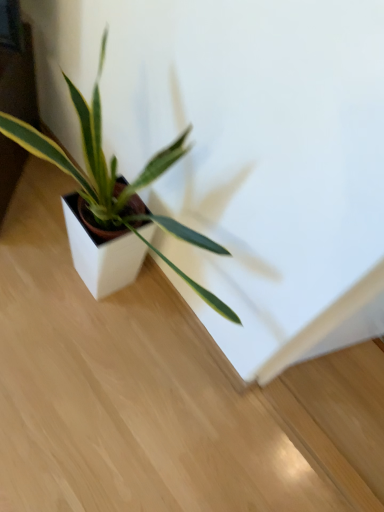
Where is `vacant space that is to the left of green matte plant at center-left`? The width and height of the screenshot is (384, 512). vacant space that is to the left of green matte plant at center-left is located at coordinates (26, 252).